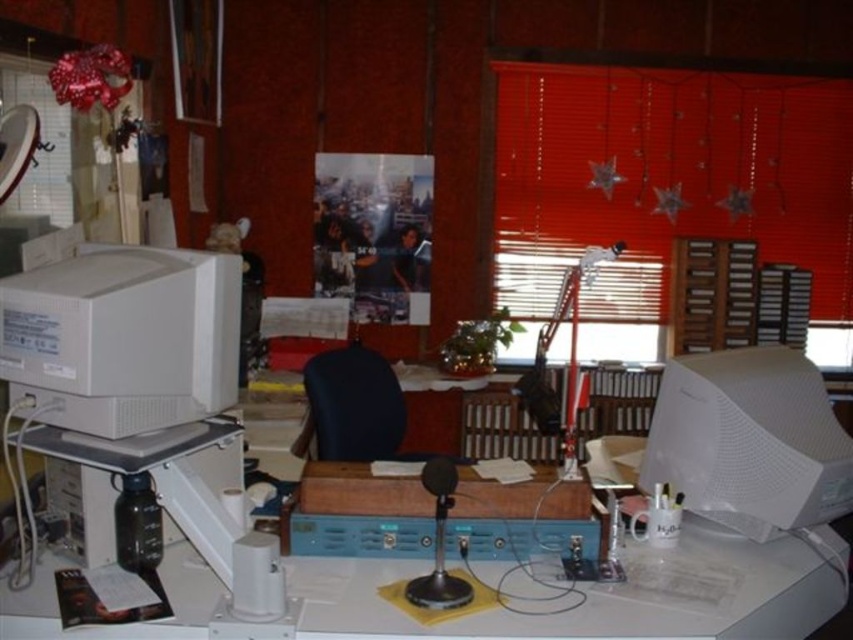
Imagine you are standing in the workspace shown in the image. There are two points marked in the scene, point (53, 364) and point (337, 355). Which of these two points is physically closer to your current position?

Point (53, 364) is closer to the viewer than point (337, 355).

You are setting up a new cable connection between the white matte desktop computer at left and the white matte computer monitor at right. Based on their positions, which one should you plug the cable into first?

The white matte desktop computer at left is above the white matte computer monitor at right, so you should plug the cable into the white matte desktop computer at left first since it is higher up.